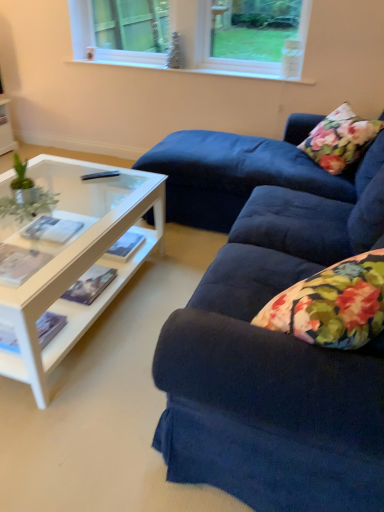
Image resolution: width=384 pixels, height=512 pixels. Describe the element at coordinates (27, 199) in the screenshot. I see `green leafy plant at left` at that location.

Where is `floral fabric pillow at upper right`? The width and height of the screenshot is (384, 512). floral fabric pillow at upper right is located at coordinates (340, 139).

I want to click on green leafy plant at left, so click(27, 199).

Is point (374, 240) positioned in front of point (42, 212)?

No, it is behind (42, 212).

From the image's perspective, would you say velvet blue couch at right is positioned over green leafy plant at left?

No, from the image's perspective, velvet blue couch at right is not above green leafy plant at left.

Can green leafy plant at left be found inside velvet blue couch at right?

No, green leafy plant at left is not a part of velvet blue couch at right.

Is velvet blue couch at right thinner than green leafy plant at left?

Correct, the width of velvet blue couch at right is less than that of green leafy plant at left.

Considering the relative sizes of white plastic window at upper center and velvet blue couch at right in the image provided, is white plastic window at upper center thinner than velvet blue couch at right?

Yes.

Is white plastic window at upper center oriented away from velvet blue couch at right?

No, velvet blue couch at right is not at the back of white plastic window at upper center.

Which object is closer to the camera, white plastic window at upper center or velvet blue couch at right?

velvet blue couch at right is in front.

Considering the relative sizes of velvet blue couch at right and floral fabric pillow at upper right in the image provided, is velvet blue couch at right shorter than floral fabric pillow at upper right?

No.

Is velvet blue couch at right bigger than floral fabric pillow at upper right?

Yes, velvet blue couch at right is bigger than floral fabric pillow at upper right.

Relative to floral fabric pillow at upper right, is velvet blue couch at right in front or behind?

velvet blue couch at right is positioned closer to the viewer than floral fabric pillow at upper right.

Based on the photo, does velvet blue couch at right appear on the right side of floral fabric pillow at upper right?

No.

Based on their sizes in the image, would you say floral fabric pillow at upper right is bigger or smaller than white plastic window at upper center?

Clearly, floral fabric pillow at upper right is smaller in size than white plastic window at upper center.

Is floral fabric pillow at upper right taller or shorter than white plastic window at upper center?

In the image, floral fabric pillow at upper right appears to be taller than white plastic window at upper center.

Considering the relative positions of floral fabric pillow at upper right and white plastic window at upper center in the image provided, is floral fabric pillow at upper right to the left or to the right of white plastic window at upper center?

Clearly, floral fabric pillow at upper right is on the right of white plastic window at upper center in the image.

Which is closer to the camera, (325, 155) or (134, 45)?

Clearly, point (325, 155) is closer to the camera than point (134, 45).

Is floral fabric pillow at upper right not close to velvet blue couch at right?

floral fabric pillow at upper right is positioned a significant distance from velvet blue couch at right.

Who is taller, floral fabric pillow at upper right or velvet blue couch at right?

velvet blue couch at right.

Is floral fabric pillow at upper right facing towards velvet blue couch at right?

No, floral fabric pillow at upper right is not facing towards velvet blue couch at right.

Which point is more distant from viewer, (x=309, y=142) or (x=373, y=223)?

The point (x=309, y=142) is farther from the camera.

Is black plastic remote control at center a part of green leafy plant at left?

No, black plastic remote control at center is not a part of green leafy plant at left.

Based on the photo, from a real-world perspective, is green leafy plant at left on black plastic remote control at center?

Yes, from a real-world perspective, green leafy plant at left is on top of black plastic remote control at center.

Is green leafy plant at left far from black plastic remote control at center?

That's not correct — green leafy plant at left is a little close to black plastic remote control at center.

Which object is closer to the camera, green leafy plant at left or black plastic remote control at center?

green leafy plant at left is closer to the camera.

Which is behind, velvet blue couch at right or white plastic window at upper center?

white plastic window at upper center is further from the camera.

Is velvet blue couch at right beside white plastic window at upper center?

velvet blue couch at right and white plastic window at upper center are not in contact.

Looking at this image, does velvet blue couch at right appear on the right side of white plastic window at upper center?

Correct, you'll find velvet blue couch at right to the right of white plastic window at upper center.

This screenshot has height=512, width=384. I want to click on studio couch that appears below the green leafy plant at left (from the image's perspective), so click(x=276, y=362).

The image size is (384, 512). I want to click on studio couch in front of the white plastic window at upper center, so coord(276,362).

When comparing their distances from velvet blue couch at right, does black plastic remote control at center or floral fabric pillow at upper right seem further?

Among the two, floral fabric pillow at upper right is located further to velvet blue couch at right.

When comparing their distances from velvet blue couch at right, does black plastic remote control at center or white plastic window at upper center seem further?

white plastic window at upper center is further to velvet blue couch at right.

Looking at the image, which one is located further to black plastic remote control at center, velvet blue couch at right or floral fabric pillow at upper right?

Based on the image, velvet blue couch at right appears to be further to black plastic remote control at center.

Looking at the image, which one is located closer to green leafy plant at left, velvet blue couch at right or floral fabric pillow at upper right?

velvet blue couch at right is closer to green leafy plant at left.

Considering their positions, is black plastic remote control at center positioned further to white plastic window at upper center than green leafy plant at left?

Based on the image, green leafy plant at left appears to be further to white plastic window at upper center.

Which object lies further to the anchor point green leafy plant at left, white plastic window at upper center or velvet blue couch at right?

white plastic window at upper center.

Estimate the real-world distances between objects in this image. Which object is closer to floral fabric pillow at upper right, white plastic window at upper center or black plastic remote control at center?

The object closer to floral fabric pillow at upper right is white plastic window at upper center.

Which object lies nearer to the anchor point black plastic remote control at center, floral fabric pillow at upper right or velvet blue couch at right?

floral fabric pillow at upper right lies closer to black plastic remote control at center than the other object.

Locate an element on the screen. remote control positioned between velvet blue couch at right and floral fabric pillow at upper right from near to far is located at coordinates (100, 175).

Where is `remote control between green leafy plant at left and floral fabric pillow at upper right from left to right`? The image size is (384, 512). remote control between green leafy plant at left and floral fabric pillow at upper right from left to right is located at coordinates (100, 175).

Locate an element on the screen. The image size is (384, 512). studio couch between green leafy plant at left and floral fabric pillow at upper right is located at coordinates (x=276, y=362).

Locate an element on the screen. remote control between velvet blue couch at right and white plastic window at upper center from front to back is located at coordinates (100, 175).